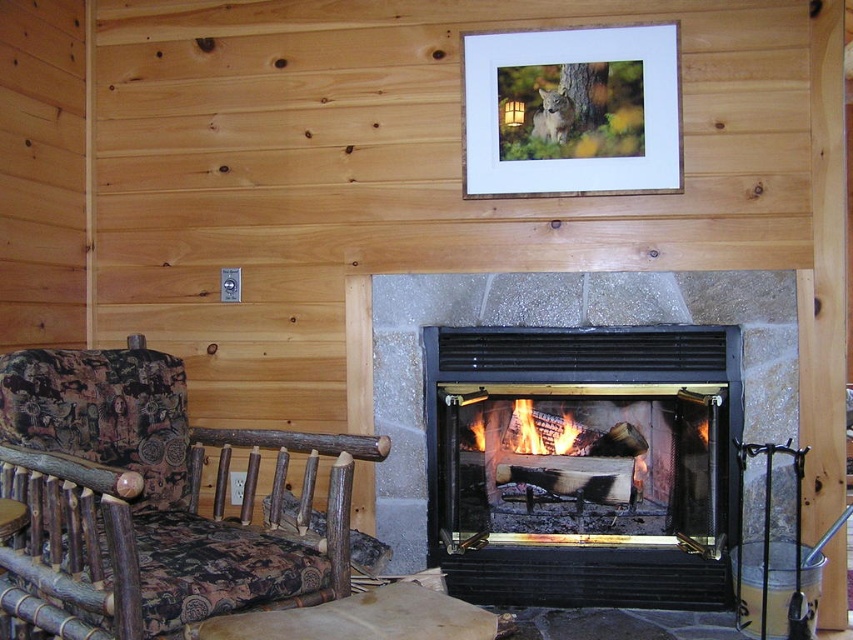
Between black glass fireplace at center and charcoal wood fire at center, which one appears on the left side from the viewer's perspective?

charcoal wood fire at center is more to the left.

Does black glass fireplace at center appear on the right side of charcoal wood fire at center?

Indeed, black glass fireplace at center is positioned on the right side of charcoal wood fire at center.

Image resolution: width=853 pixels, height=640 pixels. Find the location of `black glass fireplace at center`. black glass fireplace at center is located at coordinates (583, 464).

Identify the location of black glass fireplace at center. (583, 464).

Does wooden-patterned fabric at left have a greater width compared to wooden frame at upper center?

Indeed, wooden-patterned fabric at left has a greater width compared to wooden frame at upper center.

Measure the distance between wooden-patterned fabric at left and camera.

wooden-patterned fabric at left is 1.67 meters from camera.

The image size is (853, 640). Find the location of `wooden-patterned fabric at left`. wooden-patterned fabric at left is located at coordinates (158, 492).

Consider the image. Which is more to the left, wooden-patterned fabric at left or charcoal wood fire at center?

Positioned to the left is wooden-patterned fabric at left.

Consider the image. Who is lower down, wooden-patterned fabric at left or charcoal wood fire at center?

Positioned lower is charcoal wood fire at center.

Does point (146, 568) lie behind point (589, 467)?

That is False.

The width and height of the screenshot is (853, 640). I want to click on wooden-patterned fabric at left, so click(x=158, y=492).